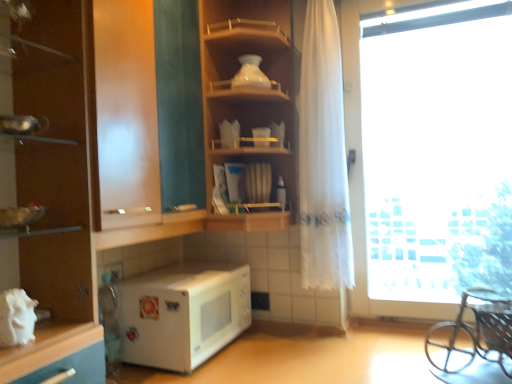
Question: Could you tell me if wooden shelf at center, which appears as the first shelf when viewed from the right, is turned towards transparent glass shelves at upper left, marked as the first shelf in a left-to-right arrangement?

Choices:
 (A) yes
 (B) no

Answer: (B)

Question: Considering the relative sizes of wooden shelf at center, which ranks as the 2th shelf in left-to-right order, and transparent glass shelves at upper left, the second shelf in the right-to-left sequence, in the image provided, is wooden shelf at center, which ranks as the 2th shelf in left-to-right order, taller than transparent glass shelves at upper left, the second shelf in the right-to-left sequence,?

Choices:
 (A) yes
 (B) no

Answer: (A)

Question: Is wooden shelf at center, which appears as the first shelf when viewed from the right, outside of transparent glass shelves at upper left, the second shelf in the right-to-left sequence?

Choices:
 (A) yes
 (B) no

Answer: (A)

Question: Does wooden shelf at center, which ranks as the 2th shelf in left-to-right order, have a smaller size compared to transparent glass shelves at upper left, the second shelf in the right-to-left sequence?

Choices:
 (A) no
 (B) yes

Answer: (B)

Question: Does wooden shelf at center, which appears as the first shelf when viewed from the right, come behind transparent glass shelves at upper left, marked as the first shelf in a left-to-right arrangement?

Choices:
 (A) no
 (B) yes

Answer: (B)

Question: Can you confirm if wooden shelf at center, which appears as the first shelf when viewed from the right, is positioned to the left of transparent glass shelves at upper left, marked as the first shelf in a left-to-right arrangement?

Choices:
 (A) yes
 (B) no

Answer: (B)

Question: Is white matte microwave at lower left at the back of transparent glass shelves at upper left, marked as the first shelf in a left-to-right arrangement?

Choices:
 (A) no
 (B) yes

Answer: (A)

Question: Does transparent glass shelves at upper left, the second shelf in the right-to-left sequence, have a lesser height compared to white matte microwave at lower left?

Choices:
 (A) yes
 (B) no

Answer: (B)

Question: From a real-world perspective, is transparent glass shelves at upper left, marked as the first shelf in a left-to-right arrangement, located beneath white matte microwave at lower left?

Choices:
 (A) yes
 (B) no

Answer: (B)

Question: Is transparent glass shelves at upper left, the second shelf in the right-to-left sequence, positioned beyond the bounds of white matte microwave at lower left?

Choices:
 (A) yes
 (B) no

Answer: (A)

Question: Considering the relative sizes of transparent glass shelves at upper left, the second shelf in the right-to-left sequence, and white matte microwave at lower left in the image provided, is transparent glass shelves at upper left, the second shelf in the right-to-left sequence, taller than white matte microwave at lower left?

Choices:
 (A) yes
 (B) no

Answer: (A)

Question: From the image's perspective, would you say transparent glass shelves at upper left, marked as the first shelf in a left-to-right arrangement, is shown under white matte microwave at lower left?

Choices:
 (A) no
 (B) yes

Answer: (A)

Question: From the image's perspective, would you say transparent glass shelves at upper left, marked as the first shelf in a left-to-right arrangement, is shown under matte brown cabinet at left?

Choices:
 (A) yes
 (B) no

Answer: (B)